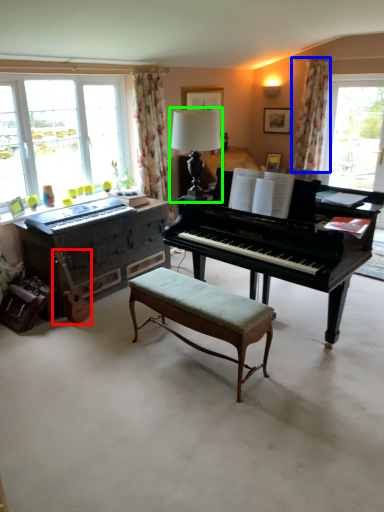
Question: Which object is the farthest from instrument (highlighted by a red box)? Choose among these: curtain (highlighted by a blue box) or table lamp (highlighted by a green box).

Choices:
 (A) curtain
 (B) table lamp

Answer: (A)